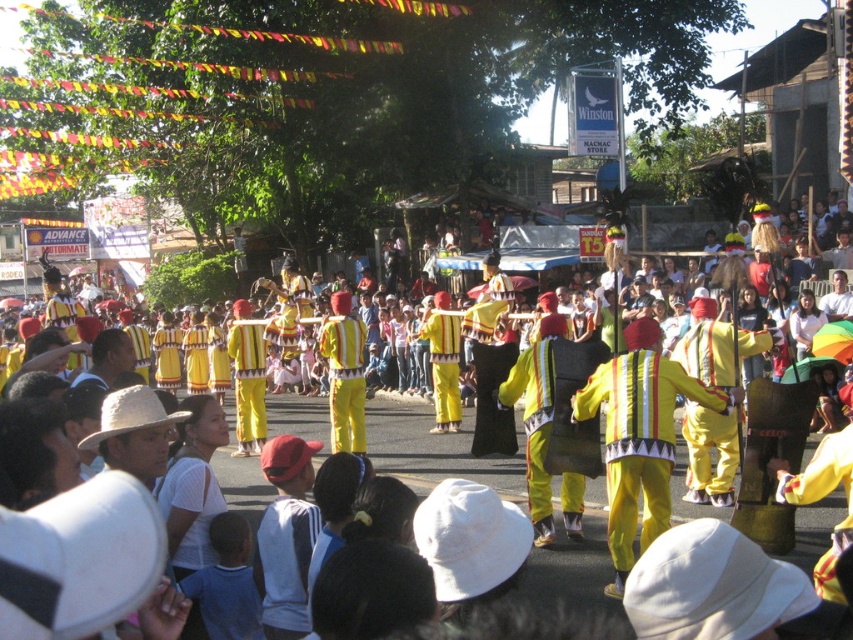
Question: Observing the image, what is the correct spatial positioning of yellow fabric costumes at center in reference to yellow fabric costume at center?

Choices:
 (A) below
 (B) above

Answer: (A)

Question: Is yellow fabric costumes at center below yellow fabric costume at center?

Choices:
 (A) no
 (B) yes

Answer: (B)

Question: Where is yellow fabric costumes at center located in relation to yellow fabric costume at center in the image?

Choices:
 (A) below
 (B) above

Answer: (A)

Question: Which object is farther from the camera taking this photo?

Choices:
 (A) yellow fabric costume at center
 (B) yellow fabric costumes at center

Answer: (A)